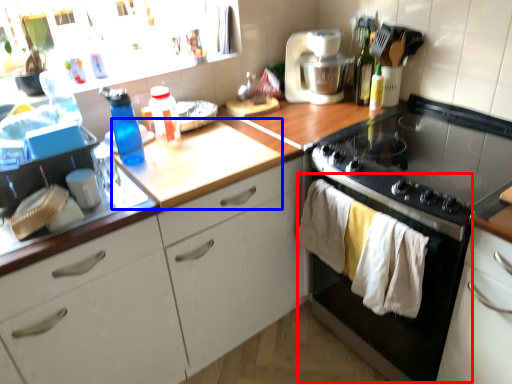
Question: Which object is closer to the camera taking this photo, oven (highlighted by a red box) or counter top (highlighted by a blue box)?

Choices:
 (A) oven
 (B) counter top

Answer: (A)